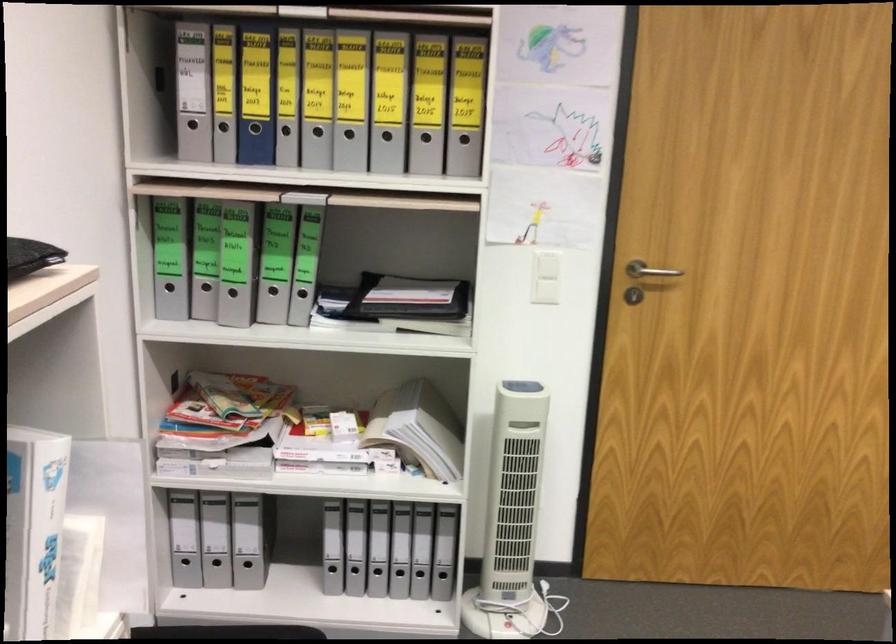
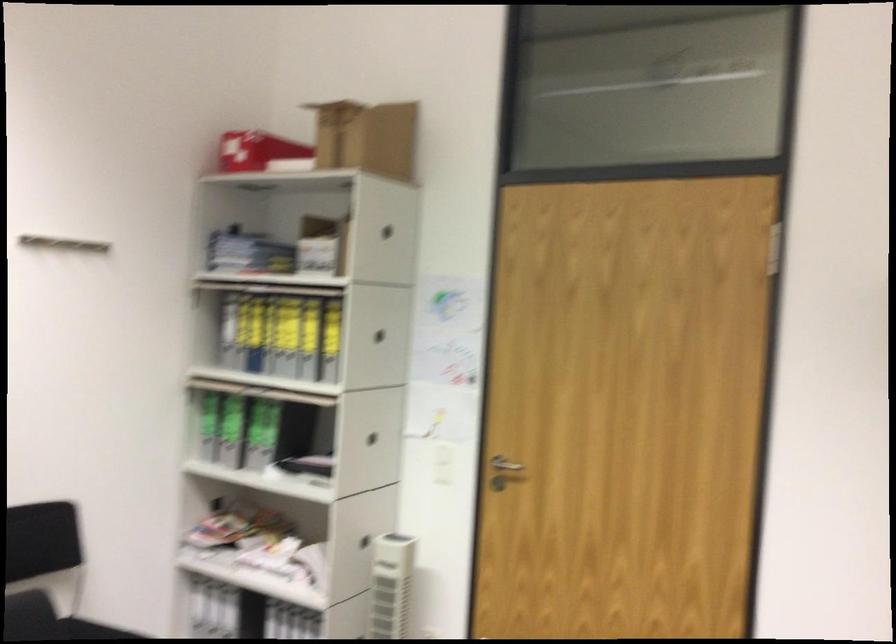
Locate, in the second image, the point that corresponds to the point at 648,277 in the first image.

(504, 464)